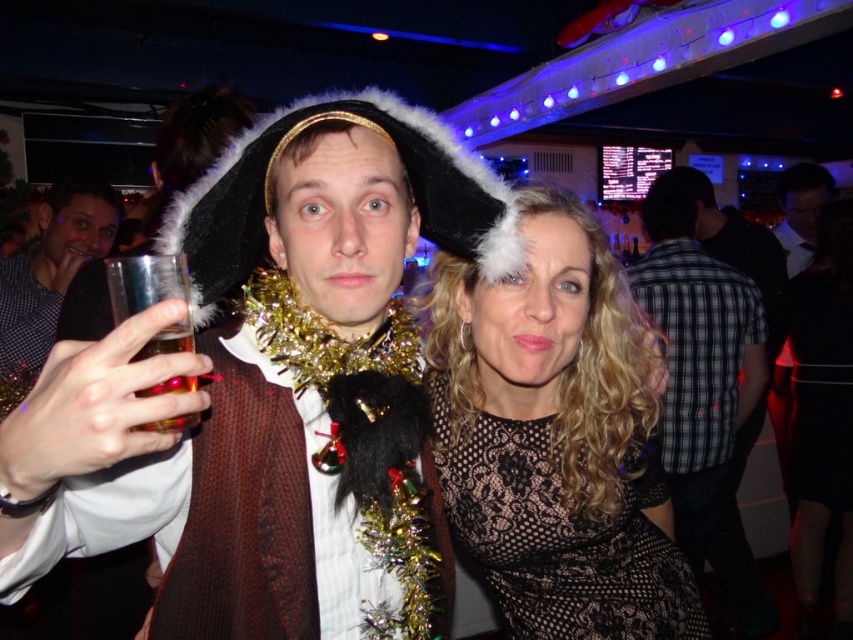
You are a bartender at the party and need to serve a drink to the person in the checkered fabric shirt at center. The matte glass cup at center is already holding a drink. Is the cup currently accessible for you to refill it?

The matte glass cup at center is positioned over checkered fabric shirt at center, meaning it is placed directly above the shirt. Since the shirt belongs to the person, this likely means the cup is in their hand or very close, making it accessible for refilling without disturbing them.

You are a guest at this party and want to grab a drink. You see the black lace dress at center and the clear plastic cup at left. Which object is closer to the floor?

The black lace dress at center is located below the clear plastic cup at left, so it is closer to the floor.